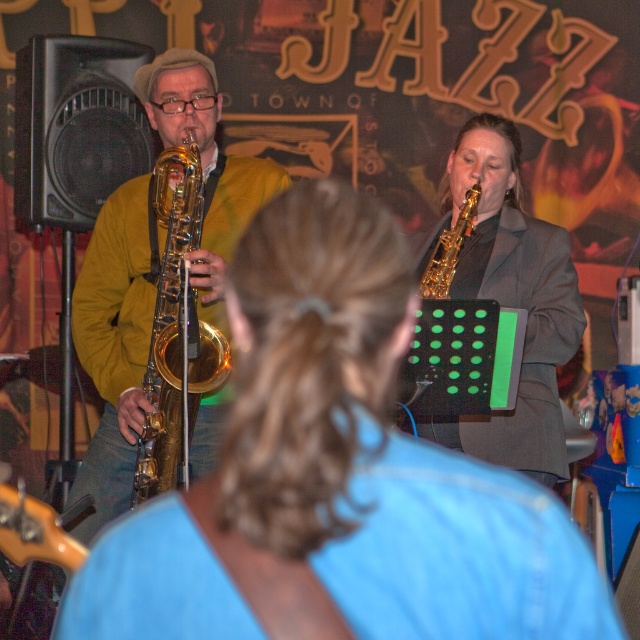
Question: Does gold shiny saxophone at center have a smaller size compared to gold shiny trumpet at left?

Choices:
 (A) yes
 (B) no

Answer: (B)

Question: Which of the following is the closest to the observer?

Choices:
 (A) gold shiny saxophone at center
 (B) shiny gold saxophone at upper center
 (C) gold shiny trumpet at left

Answer: (B)

Question: Is gold shiny trumpet at left positioned at the back of gold shiny trumpet at right?

Choices:
 (A) yes
 (B) no

Answer: (B)

Question: Among these objects, which one is farthest from the camera?

Choices:
 (A) shiny gold saxophone at upper center
 (B) gold shiny trumpet at right
 (C) gold shiny saxophone at center
 (D) gold shiny trumpet at left

Answer: (B)

Question: Is shiny gold saxophone at upper center below gold shiny trumpet at left?

Choices:
 (A) yes
 (B) no

Answer: (A)

Question: Estimate the real-world distances between objects in this image. Which object is closer to the gold shiny saxophone at center?

Choices:
 (A) gold shiny trumpet at left
 (B) gold shiny trumpet at right

Answer: (A)